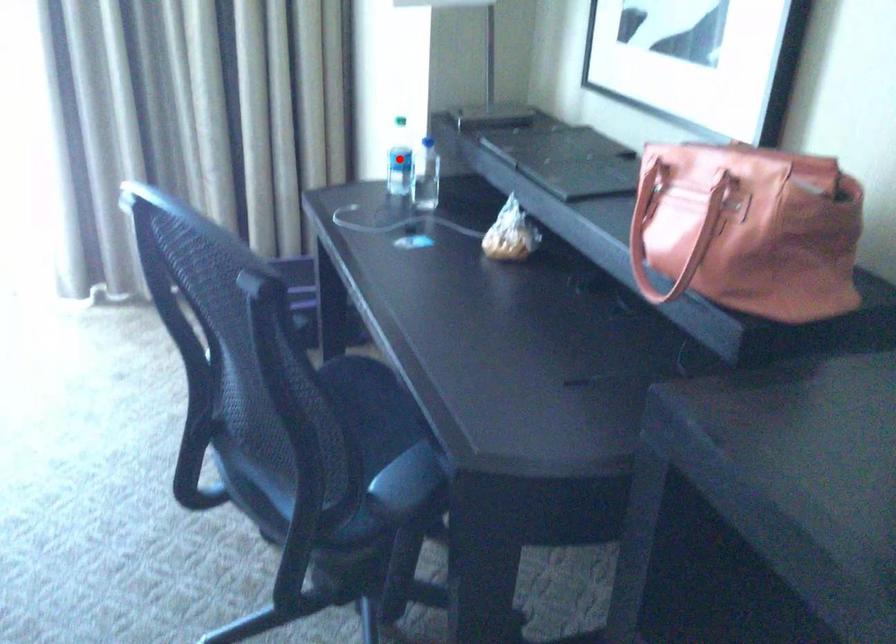
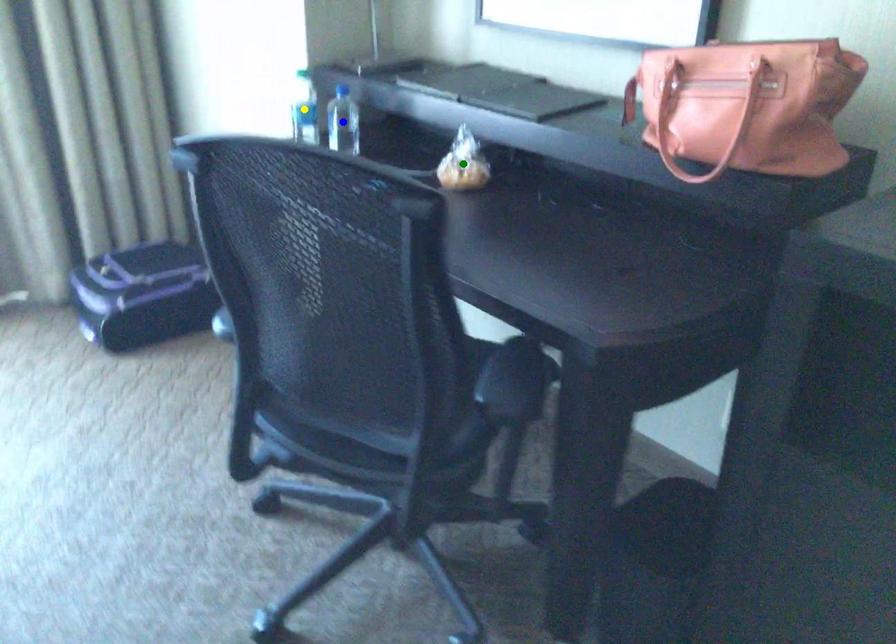
Question: I am providing you with two images of the same scene from different viewpoints. A red point is marked on the first image. You are given multiple points on the second image. Can you choose the point in image 2 that corresponds to the point in image 1?

Choices:
 (A) yellow point
 (B) blue point
 (C) green point

Answer: (A)